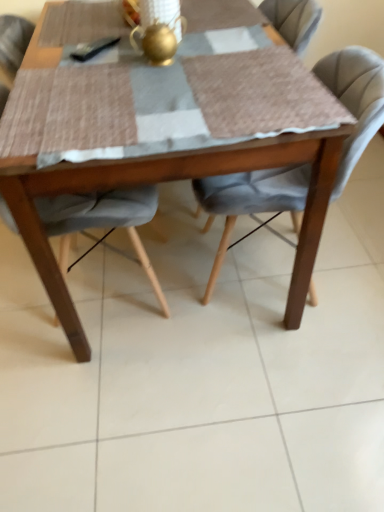
The image size is (384, 512). Find the location of `free space to the left of gold metallic teapot at center`. free space to the left of gold metallic teapot at center is located at coordinates (98, 69).